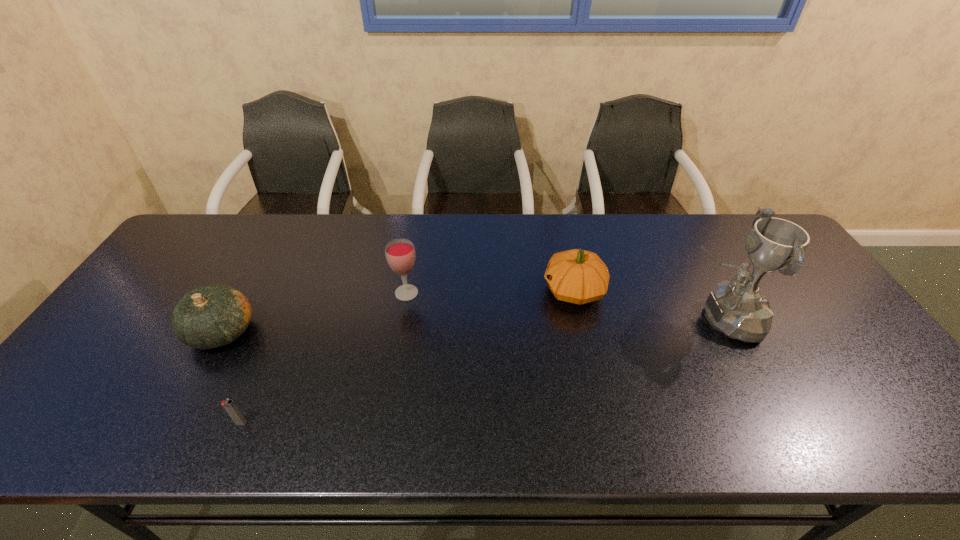
Locate an element on the screen. award is located at coordinates (738, 309).

Image resolution: width=960 pixels, height=540 pixels. In order to click on the rightmost object in this screenshot , I will do `click(738, 309)`.

What are the coordinates of `wineglass` in the screenshot? It's located at (400, 254).

What are the coordinates of `the fourth object from left to right` in the screenshot? It's located at [x=577, y=276].

Find the location of a particular element. The image size is (960, 540). the leftmost object is located at coordinates [212, 316].

In order to click on the shortest object in this screenshot , I will do `click(230, 407)`.

Find the location of a particular element. The height and width of the screenshot is (540, 960). the nearest object is located at coordinates (230, 407).

You are a GUI agent. You are given a task and a screenshot of the screen. Output one action in this format:
    pyautogui.click(x=<x>, y=<y>)
    Task: Click on the blank area located on the side with emblem of the rightmost object
    This screenshot has width=960, height=540.
    Given the screenshot: What is the action you would take?
    pyautogui.click(x=630, y=319)

The height and width of the screenshot is (540, 960). I want to click on free space located 0.200m on the side with emblem of the rightmost object, so click(608, 319).

Locate an element on the screen. This screenshot has height=540, width=960. free region located 0.310m on the side with emblem of the rightmost object is located at coordinates (567, 319).